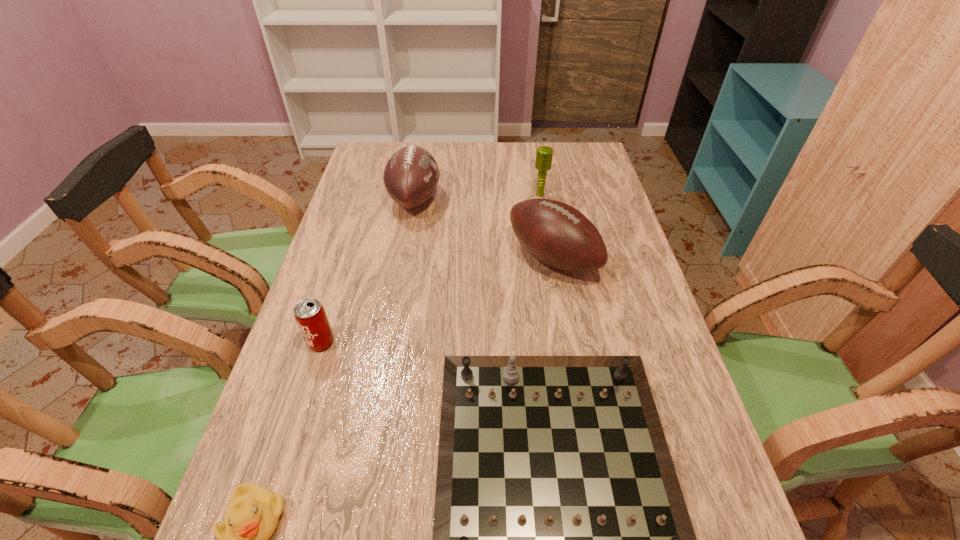
I want to click on vacant position located 0.350m on the front of the fourth tallest object, so click(266, 518).

Where is `object that is at the far edge`? The width and height of the screenshot is (960, 540). object that is at the far edge is located at coordinates (411, 175).

Where is `football (American) that is at the left edge`? This screenshot has height=540, width=960. football (American) that is at the left edge is located at coordinates (411, 175).

This screenshot has width=960, height=540. I want to click on beer can at the left edge, so click(309, 313).

Locate an element on the screen. object situated at the right edge is located at coordinates (556, 234).

Where is `object positioned at the far left corner`? object positioned at the far left corner is located at coordinates (411, 175).

What are the coordinates of `free space at the far edge of the desktop` in the screenshot? It's located at (515, 147).

At what (x,y) coordinates should I click in order to perform the action: click on free spot at the left edge of the desktop. Please return your answer as a coordinate pair (x, y). The width and height of the screenshot is (960, 540). Looking at the image, I should click on (336, 323).

Where is `vacant space at the right edge`? The height and width of the screenshot is (540, 960). vacant space at the right edge is located at coordinates (605, 226).

Where is `vacant point located between the third object from left to right and the fourth farthest object`? vacant point located between the third object from left to right and the fourth farthest object is located at coordinates (368, 271).